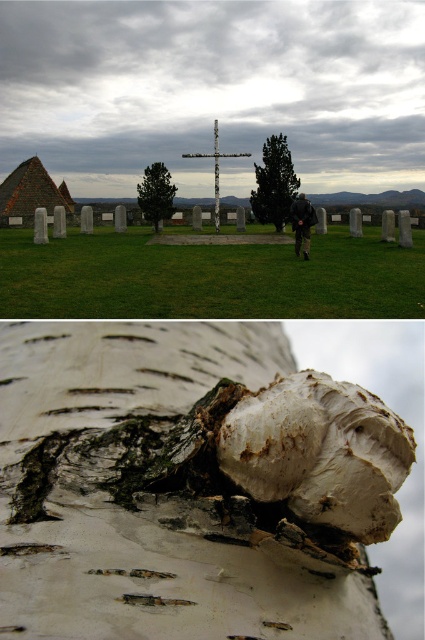
You are an artist planning to paint the scene with the white birch bark at center and the white textured mushroom at center. Which object should you make larger in your painting to accurately represent their sizes as seen in the image?

The white textured mushroom at center should be painted larger since it is bigger than the white birch bark at center in the image.

You are a visitor in the area and want to take a photo of the white birch bark at center and the white bark hut at left. Which object should you focus on first if you want to capture both in the same frame without moving the camera?

You should focus on the white birch bark at center first because it is located below the white bark hut at left, so adjusting the camera angle to include both would require framing from the lower object upwards.

Based on the photo, you are standing at the point marked by the coordinates point (31, 193) in the image. What object are you closest to?

You are closest to the white bark hut at left because the coordinates point (31, 193) corresponds to it.